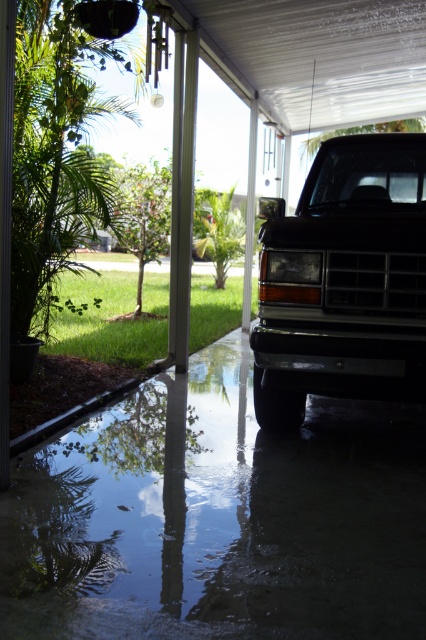
Question: Which point is farther to the camera?

Choices:
 (A) (393, 586)
 (B) (400, 339)

Answer: (B)

Question: Considering the relative positions of glossy concrete flood at lower center and black matte truck at center in the image provided, where is glossy concrete flood at lower center located with respect to black matte truck at center?

Choices:
 (A) above
 (B) below

Answer: (B)

Question: Does glossy concrete flood at lower center have a larger size compared to black matte truck at center?

Choices:
 (A) yes
 (B) no

Answer: (A)

Question: Which point is closer to the camera taking this photo?

Choices:
 (A) (373, 346)
 (B) (207, 593)

Answer: (B)

Question: Is glossy concrete flood at lower center below black matte truck at center?

Choices:
 (A) yes
 (B) no

Answer: (A)